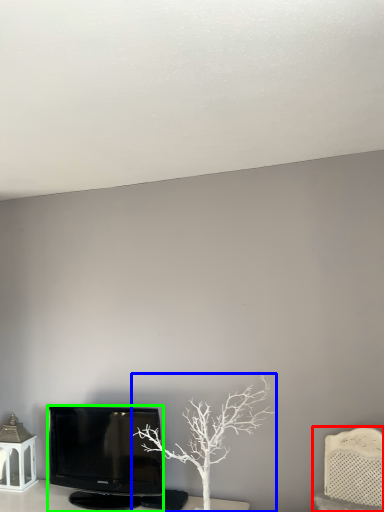
Question: Which is farther away from furniture (highlighted by a red box)? tree (highlighted by a blue box) or television (highlighted by a green box)?

Choices:
 (A) tree
 (B) television

Answer: (B)